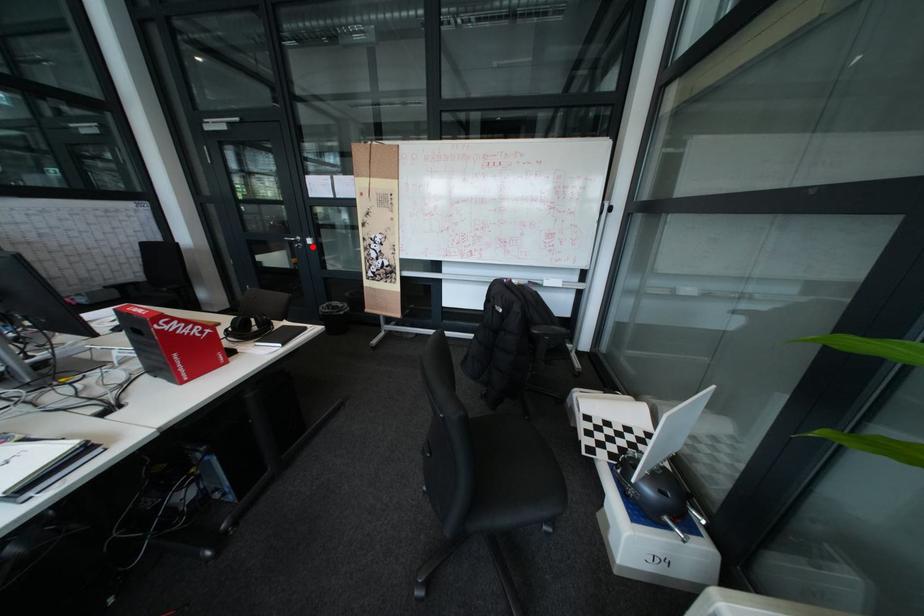
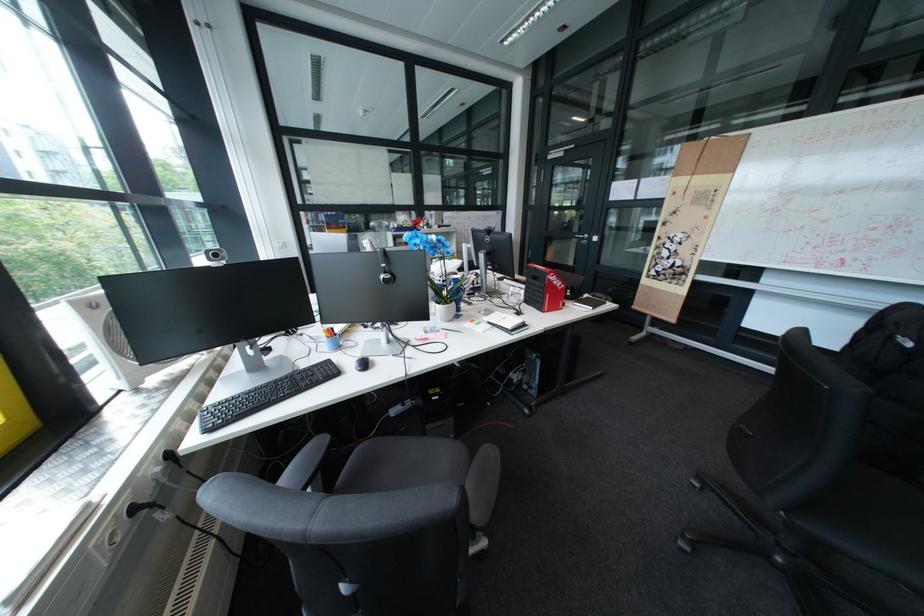
The point at the highlighted location is marked in the first image. Where is the corresponding point in the second image?

(598, 243)